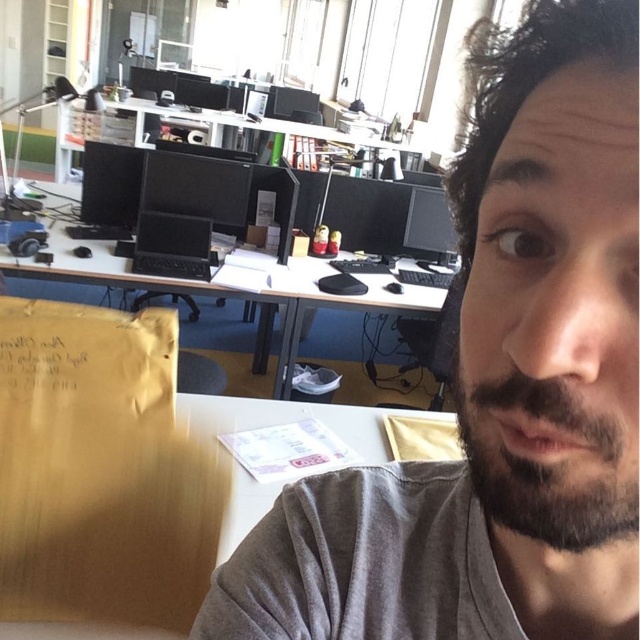
You are standing in an office and see a point marked at coordinates (554, 378). If you want to place a 12 inch ruler on the desk so that one end touches this point, will the ruler fit entirely on the desk?

The point is 10.71 inches from the viewer. Since the ruler is 12 inches long, placing it so one end is at the point would extend beyond the desk unless there is enough space. However, without knowing the desk dimensions, we can only confirm the distance from the viewer. The question cannot be definitively answered with the given information.

You are a delivery robot entering an office space and need to place a package on the desk closest to the dark brown fuzzy beard at lower right. The package is 15 cm wide. Can you confirm if there is enough space on the desk at point (547, 461) to place the package?

The dark brown fuzzy beard at lower right is located at point (547, 461). Since the desk at that point has light colored surface and office supplies like papers and folders, there might be enough space. However, without specific desk dimensions, it is uncertain whether the 15 cm width package will fit. Please check the desk space before placing the package.